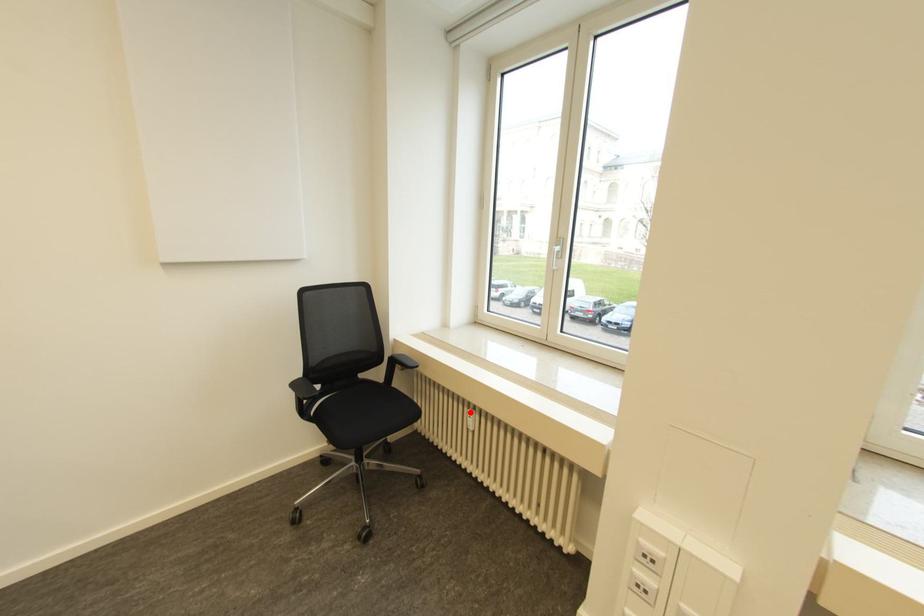
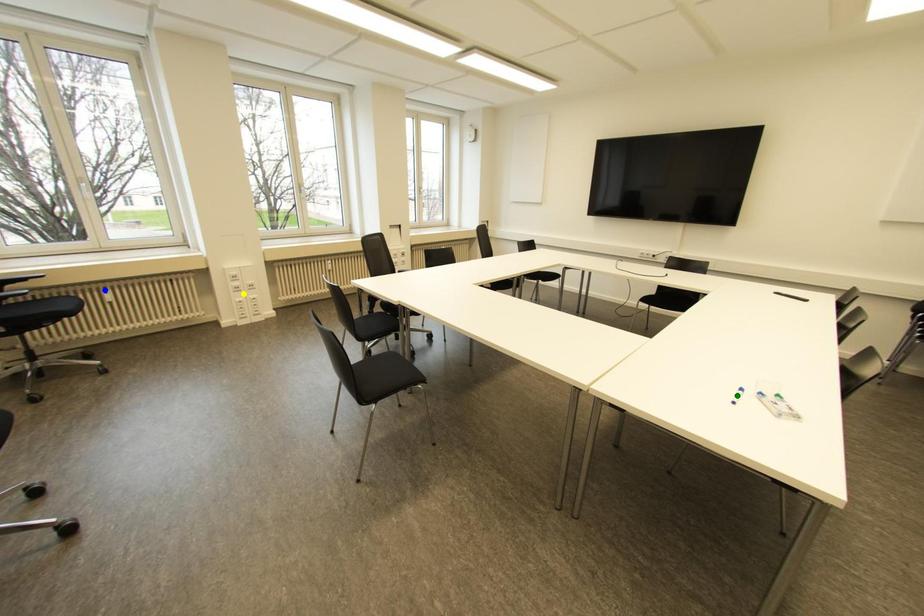
Question: I am providing you with two images of the same scene from different viewpoints. A red point is marked on the first image. You are given multiple points on the second image. In image 2, which mark is for the same physical point as the one in image 1?

Choices:
 (A) blue point
 (B) yellow point
 (C) green point

Answer: (A)